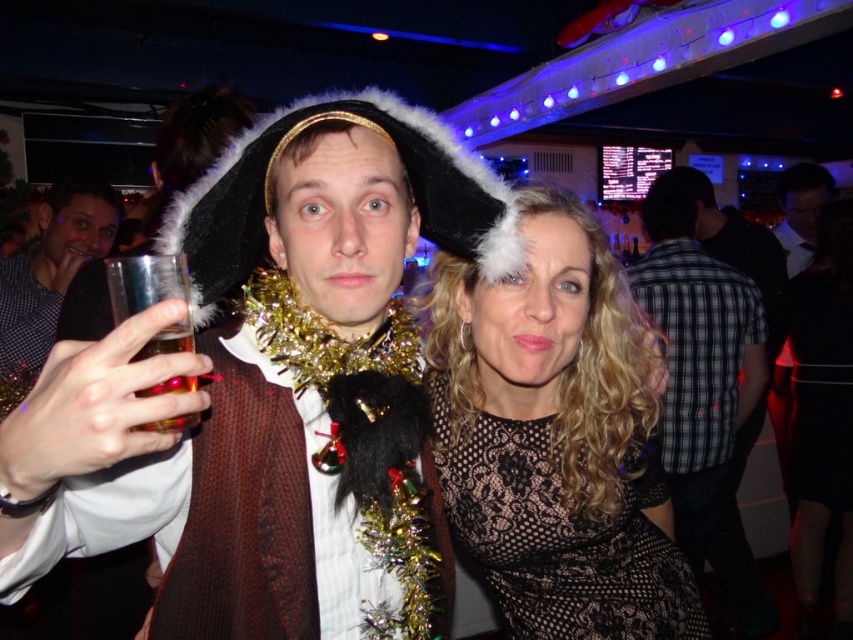
Question: Is checkered fabric shirt at center positioned at the back of translucent glass at upper left?

Choices:
 (A) yes
 (B) no

Answer: (A)

Question: Considering the relative positions of checkered fabric shirt at center and translucent glass at upper left in the image provided, where is checkered fabric shirt at center located with respect to translucent glass at upper left?

Choices:
 (A) left
 (B) right

Answer: (B)

Question: Which is nearer to the black lace dress at center?

Choices:
 (A) matte glass cup at center
 (B) checkered fabric shirt at center

Answer: (A)

Question: Based on their relative distances, which object is farther from the black lace dress at center?

Choices:
 (A) clear plastic cup at left
 (B) matte glass cup at center
 (C) translucent glass at upper left

Answer: (A)

Question: Is matte glass cup at center to the left of black lace dress at center from the viewer's perspective?

Choices:
 (A) yes
 (B) no

Answer: (A)

Question: Based on their relative distances, which object is farther from the black lace dress at center?

Choices:
 (A) clear plastic cup at left
 (B) matte glass cup at center
 (C) translucent glass at upper left

Answer: (A)